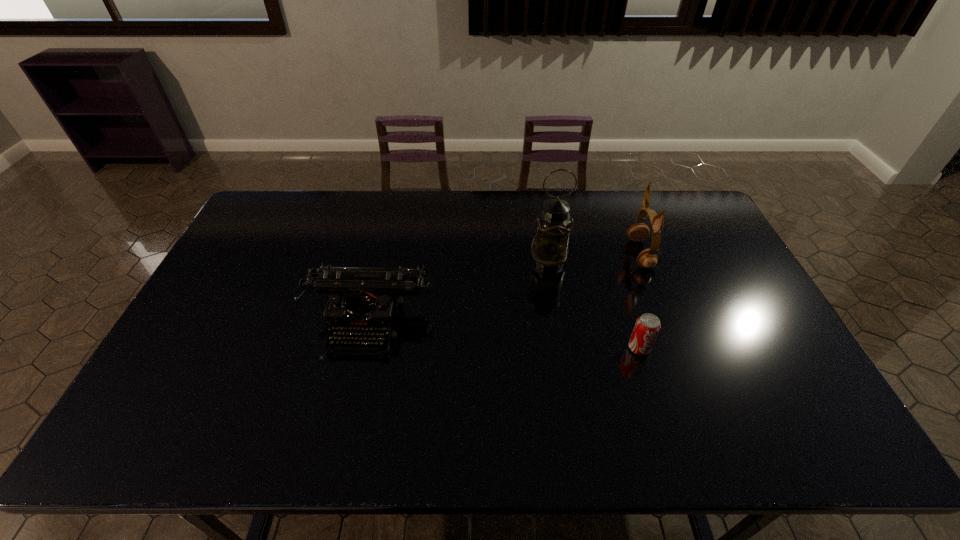
Locate an element on the screen. unoccupied area between the oil lamp and the third shortest object is located at coordinates tap(594, 258).

Locate an element on the screen. This screenshot has width=960, height=540. vacant area that lies between the third object from left to right and the oil lamp is located at coordinates (594, 305).

Locate an element on the screen. free space between the third shortest object and the second object from left to right is located at coordinates (594, 258).

At what (x,y) coordinates should I click in order to perform the action: click on free spot between the tallest object and the typewriter. Please return your answer as a coordinate pair (x, y). The image size is (960, 540). Looking at the image, I should click on (459, 292).

Where is `vacant space that's between the rightmost object and the second object from left to right`? The width and height of the screenshot is (960, 540). vacant space that's between the rightmost object and the second object from left to right is located at coordinates (594, 258).

Identify the location of unoccupied position between the oil lamp and the leftmost object. The height and width of the screenshot is (540, 960). (459, 292).

Identify the location of free area in between the shortest object and the oil lamp. The width and height of the screenshot is (960, 540). (594, 305).

The height and width of the screenshot is (540, 960). I want to click on empty location between the second object from left to right and the earphone, so click(594, 258).

This screenshot has width=960, height=540. I want to click on free space between the third object from right to left and the third tallest object, so click(459, 292).

Locate an element on the screen. The height and width of the screenshot is (540, 960). vacant space that's between the third shortest object and the second shortest object is located at coordinates (505, 288).